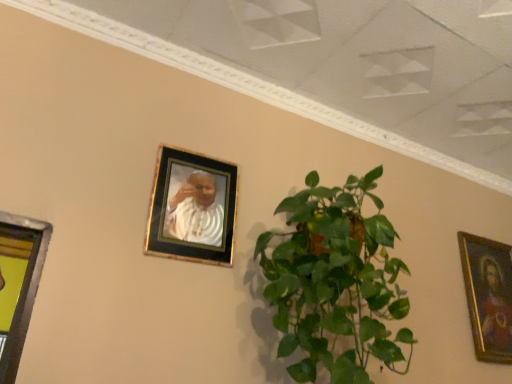
Question: From the image's perspective, is green leafy plant at center positioned above or below gold-framed photo at upper center, placed as the first picture frame when sorted from left to right?

Choices:
 (A) above
 (B) below

Answer: (B)

Question: From their relative heights in the image, would you say green leafy plant at center is taller or shorter than gold-framed photo at upper center, placed as the first picture frame when sorted from left to right?

Choices:
 (A) short
 (B) tall

Answer: (B)

Question: Based on their relative distances, which object is nearer to the gold-framed photo at upper center, placed as the 2th picture frame when sorted from bottom to top?

Choices:
 (A) green leafy plant at center
 (B) gold-framed painting at right, the 2th picture frame when ordered from front to back

Answer: (A)

Question: Based on their relative distances, which object is farther from the gold-framed photo at upper center, arranged as the first picture frame when viewed from the top?

Choices:
 (A) gold-framed painting at right, acting as the first picture frame starting from the bottom
 (B) green leafy plant at center

Answer: (A)